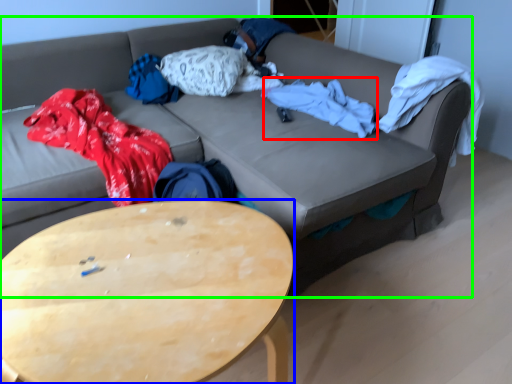
Question: Which object is positioned closest to blanket (highlighted by a red box)? Select from coffee table (highlighted by a blue box) and studio couch (highlighted by a green box).

Choices:
 (A) coffee table
 (B) studio couch

Answer: (B)